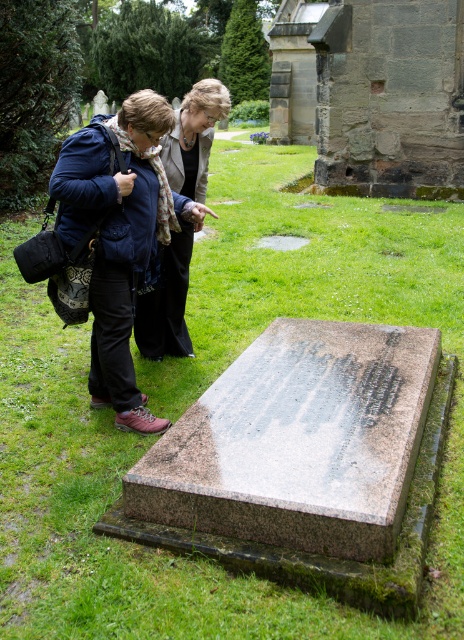
Does matte blue jacket at upper left have a greater height compared to matte black jacket at center?

Correct, matte blue jacket at upper left is much taller as matte black jacket at center.

Find the location of `matte blue jacket at upper left`. matte blue jacket at upper left is located at coordinates (120, 237).

Find the location of a particular element. The height and width of the screenshot is (640, 464). matte blue jacket at upper left is located at coordinates (120, 237).

Can you confirm if granite gravestone at center is bigger than matte blue jacket at upper left?

Yes, granite gravestone at center is bigger than matte blue jacket at upper left.

Who is more forward, (375, 442) or (141, 99)?

Point (375, 442) is in front.

Locate an element on the screen. The height and width of the screenshot is (640, 464). granite gravestone at center is located at coordinates (298, 440).

Find the location of a particular element. granite gravestone at center is located at coordinates (298, 440).

Between granite gravestone at center and matte black jacket at center, which one has more height?

With more height is matte black jacket at center.

Is point (179, 435) positioned before point (139, 314)?

Yes.

At what (x,y) coordinates should I click in order to perform the action: click on granite gravestone at center. Please return your answer as a coordinate pair (x, y). The height and width of the screenshot is (640, 464). Looking at the image, I should click on (298, 440).